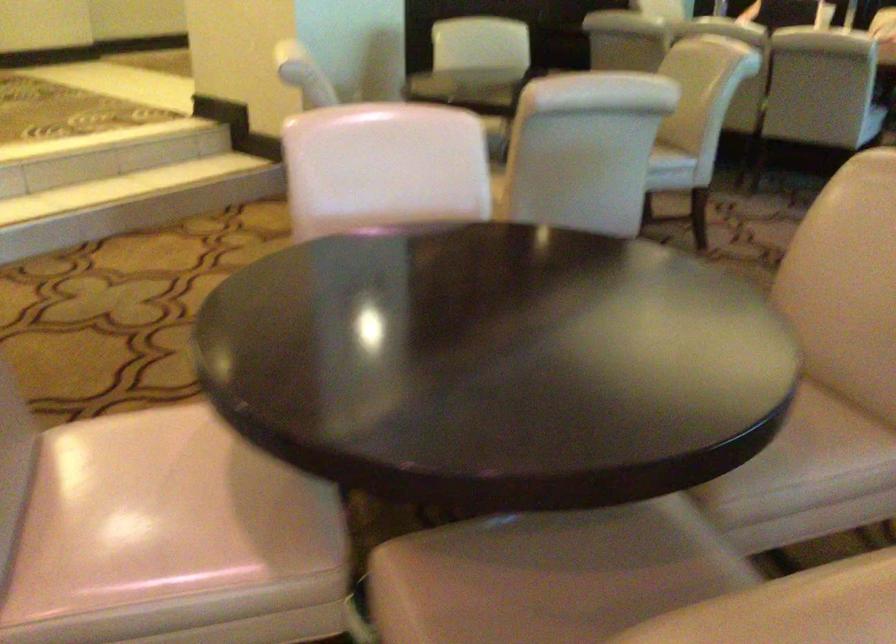
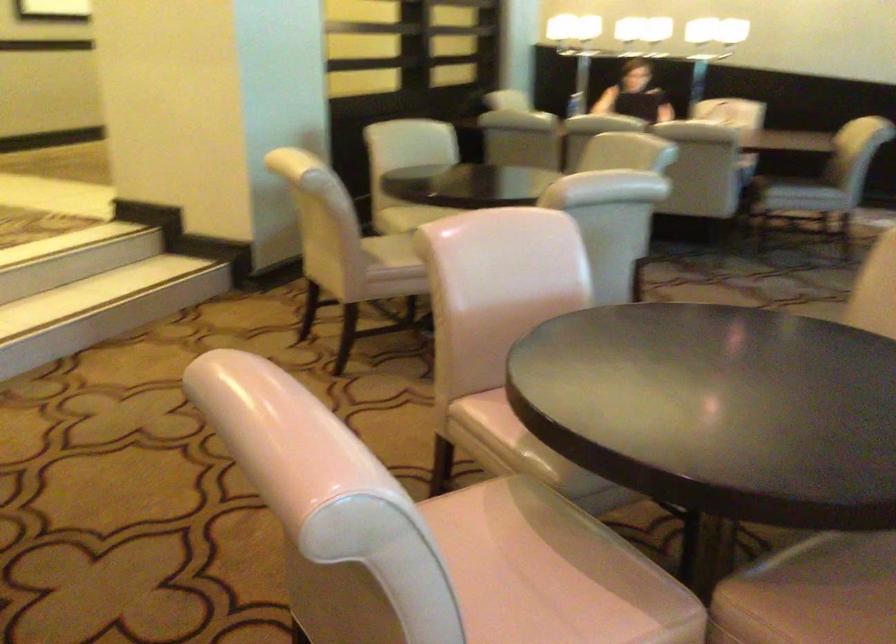
Question: I am providing you with two images of the same scene from different viewpoints. Which of the following objects are not visible in image2?

Choices:
 (A) chair sitting surface
 (B) pink chair sitting surface
 (C) brown food bag
 (D) white chair sitting surface

Answer: (D)